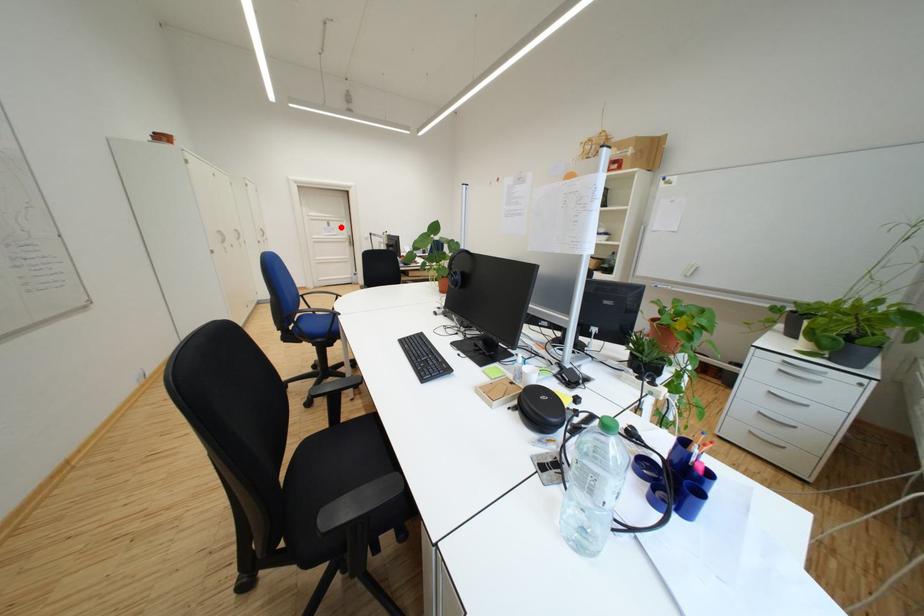
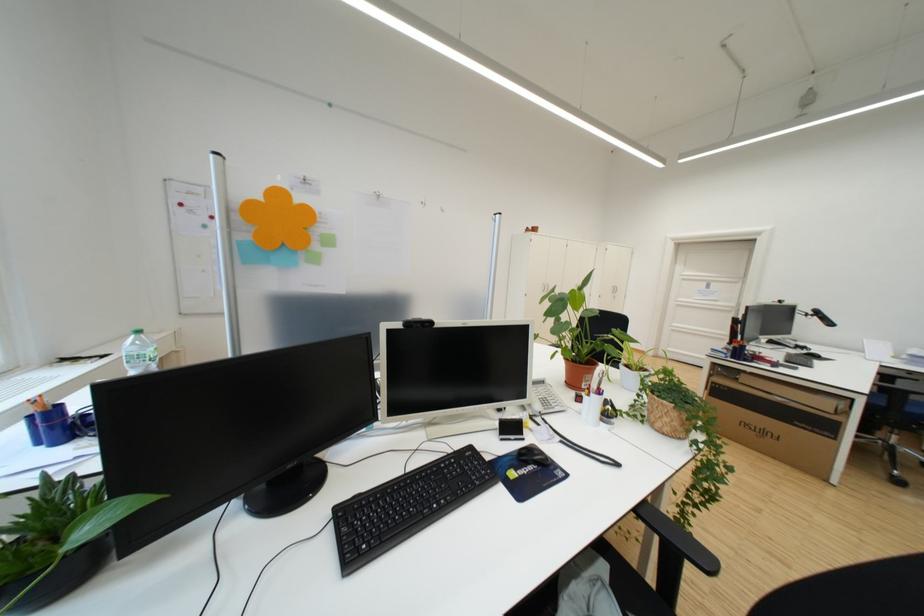
In the second image, find the point that corresponds to the highlighted location in the first image.

(720, 288)